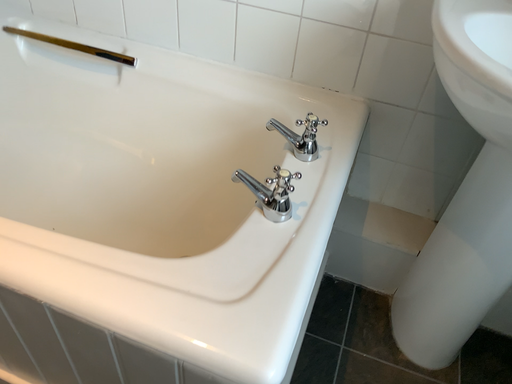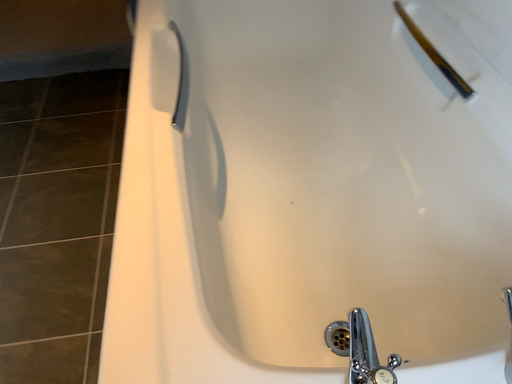
Question: How did the camera likely rotate when shooting the video?

Choices:
 (A) rotated downward
 (B) rotated upward

Answer: (B)